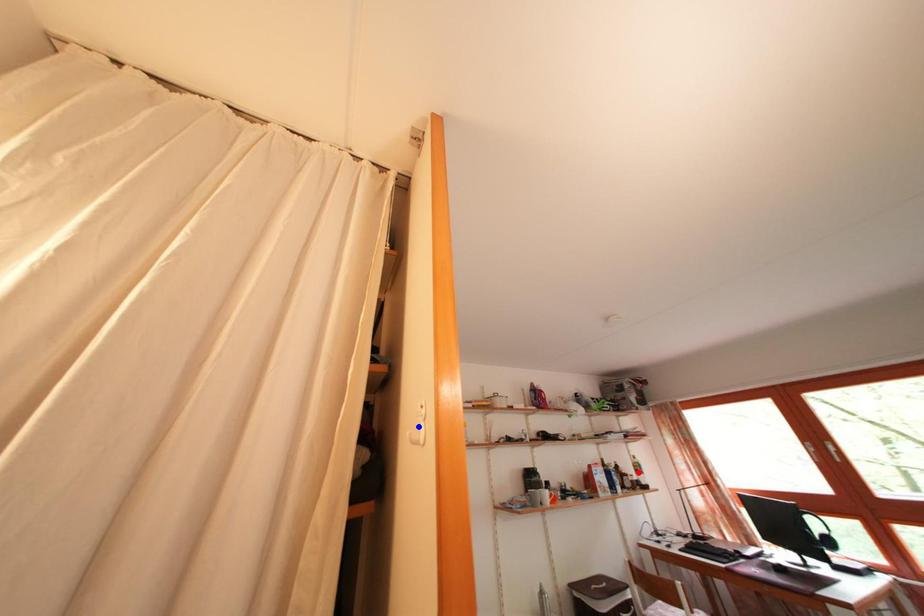
Question: Which of the two points in the image is closer to the camera?

Choices:
 (A) Blue point is closer.
 (B) Red point is closer.

Answer: (A)